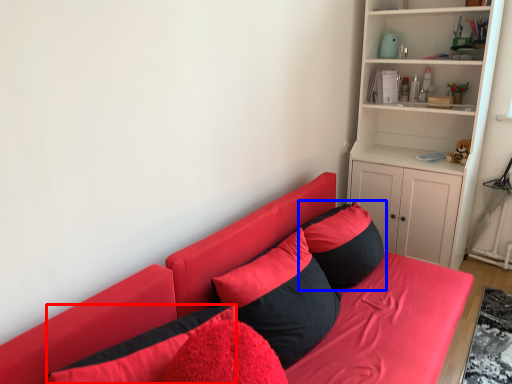
Question: Which object appears closest to the camera in this image, pillow (highlighted by a red box) or pillow (highlighted by a blue box)?

Choices:
 (A) pillow
 (B) pillow

Answer: (A)